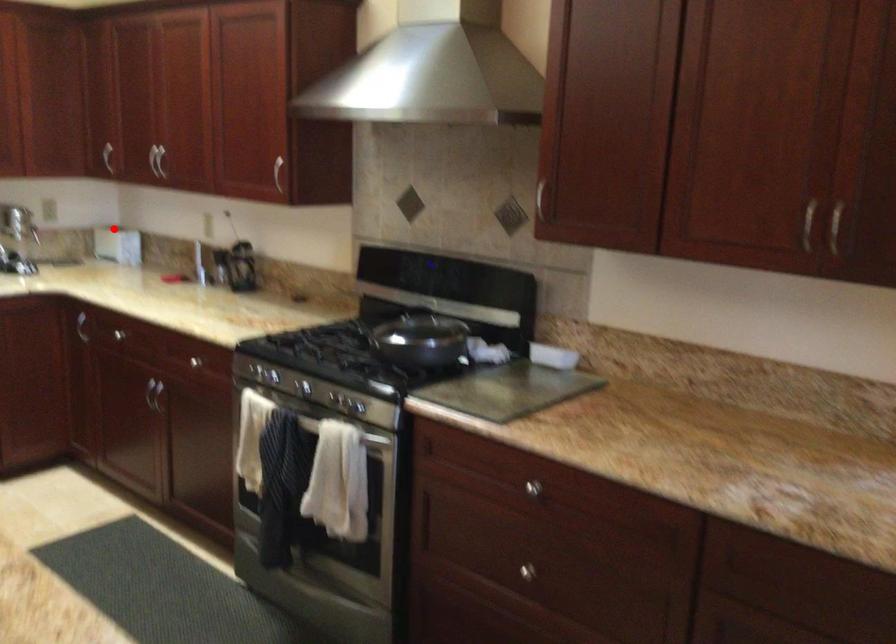
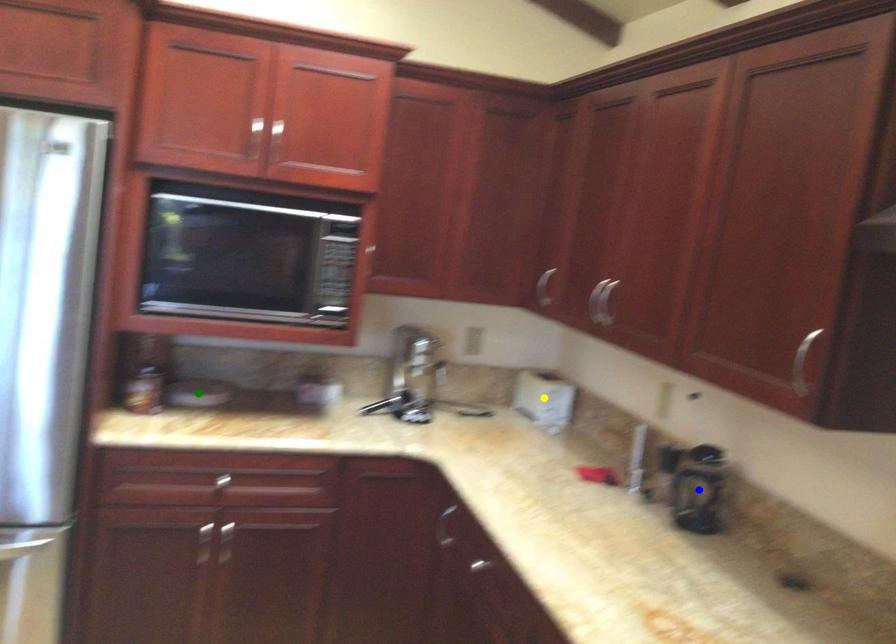
Question: I am providing you with two images of the same scene from different viewpoints. A red point is marked on the first image. You are given multiple points on the second image. Can you choose the point in image 2 that corresponds to the point in image 1?

Choices:
 (A) yellow point
 (B) green point
 (C) blue point

Answer: (A)